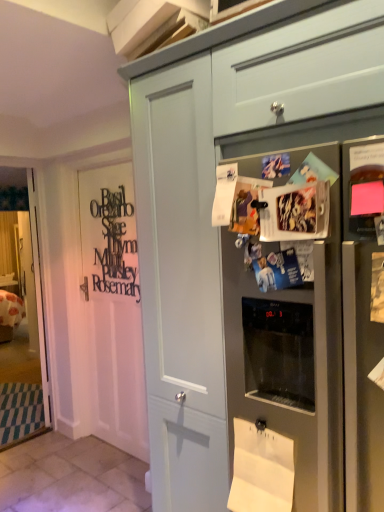
Question: Is matte gray drawer at upper center looking in the opposite direction of white wood door at left?

Choices:
 (A) no
 (B) yes

Answer: (A)

Question: Considering the relative sizes of matte gray drawer at upper center and white wood door at left in the image provided, is matte gray drawer at upper center smaller than white wood door at left?

Choices:
 (A) yes
 (B) no

Answer: (B)

Question: From a real-world perspective, is matte gray drawer at upper center located beneath white wood door at left?

Choices:
 (A) no
 (B) yes

Answer: (A)

Question: Is matte gray drawer at upper center in front of white wood door at left?

Choices:
 (A) no
 (B) yes

Answer: (B)

Question: Is white wood door at left surrounded by matte gray drawer at upper center?

Choices:
 (A) yes
 (B) no

Answer: (B)

Question: Is the position of matte gray drawer at upper center more distant than that of white wood door at left?

Choices:
 (A) yes
 (B) no

Answer: (B)

Question: Is matte gray cabinet at center taller than clear glass door at left?

Choices:
 (A) no
 (B) yes

Answer: (A)

Question: Can you confirm if matte gray cabinet at center is positioned to the right of clear glass door at left?

Choices:
 (A) no
 (B) yes

Answer: (B)

Question: Is matte gray cabinet at center with clear glass door at left?

Choices:
 (A) no
 (B) yes

Answer: (A)

Question: Is matte gray cabinet at center looking in the opposite direction of clear glass door at left?

Choices:
 (A) yes
 (B) no

Answer: (B)

Question: From a real-world perspective, is matte gray cabinet at center located beneath clear glass door at left?

Choices:
 (A) no
 (B) yes

Answer: (B)

Question: Is clear glass door at left inside matte gray cabinet at center?

Choices:
 (A) yes
 (B) no

Answer: (B)

Question: Can you confirm if clear glass door at left is positioned to the left of satin silver refrigerator at upper right?

Choices:
 (A) no
 (B) yes

Answer: (B)